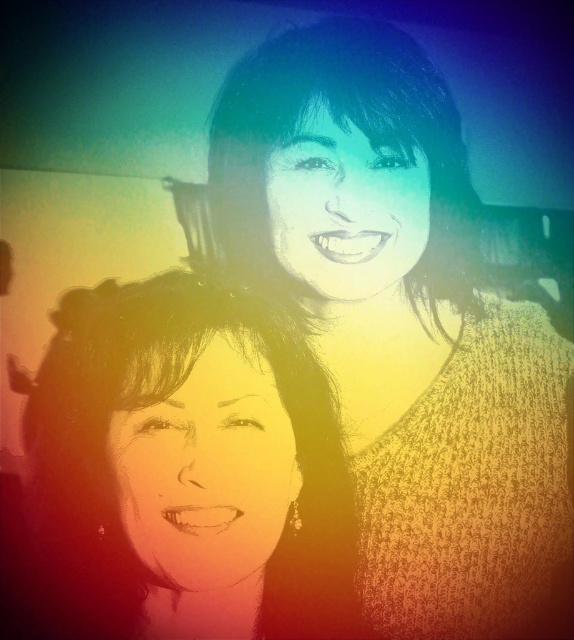
Consider the image. Is the position of smooth black hair at upper center more distant than that of matte yellow face at center?

Yes, it is behind matte yellow face at center.

Can you confirm if smooth black hair at upper center is shorter than matte yellow face at center?

Incorrect, smooth black hair at upper center's height does not fall short of matte yellow face at center's.

Between point (265, 99) and point (160, 531), which one is positioned behind?

The point (265, 99) is more distant.

Where is `smooth black hair at upper center`? This screenshot has height=640, width=574. smooth black hair at upper center is located at coordinates (343, 129).

Can you confirm if smooth skin face at center is positioned above matte yellow face at center?

Actually, smooth skin face at center is below matte yellow face at center.

Is smooth skin face at center below matte yellow face at center?

Correct, smooth skin face at center is located below matte yellow face at center.

Image resolution: width=574 pixels, height=640 pixels. Describe the element at coordinates (164, 397) in the screenshot. I see `smooth skin face at center` at that location.

I want to click on smooth skin face at center, so click(x=164, y=397).

Can you confirm if knitted sweater at upper right is taller than smooth skin face at center?

Indeed, knitted sweater at upper right has a greater height compared to smooth skin face at center.

Can you confirm if knitted sweater at upper right is thinner than smooth skin face at center?

In fact, knitted sweater at upper right might be wider than smooth skin face at center.

What do you see at coordinates (395, 340) in the screenshot?
I see `knitted sweater at upper right` at bounding box center [395, 340].

Where is `knitted sweater at upper right`? knitted sweater at upper right is located at coordinates (395, 340).